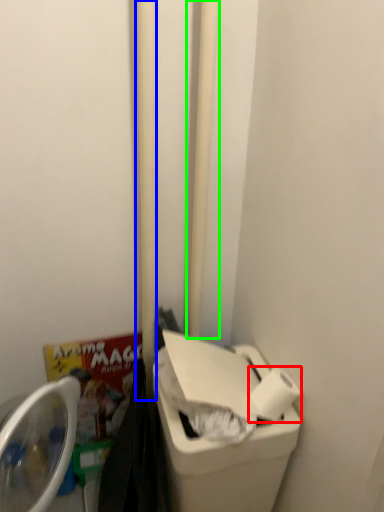
Question: Which object is positioned farthest from toilet paper (highlighted by a red box)? Select from pole (highlighted by a blue box) and pole (highlighted by a green box).

Choices:
 (A) pole
 (B) pole

Answer: (B)